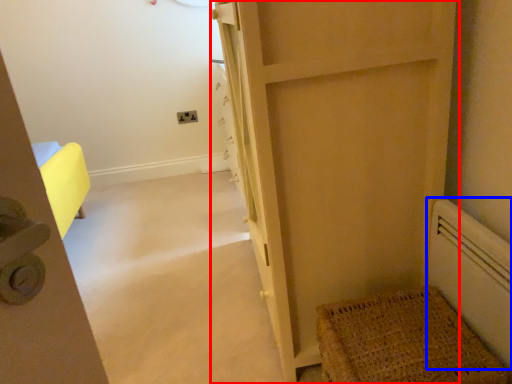
Question: Which of the following is the closest to the observer, door (highlighted by a red box) or radiator (highlighted by a blue box)?

Choices:
 (A) door
 (B) radiator

Answer: (B)